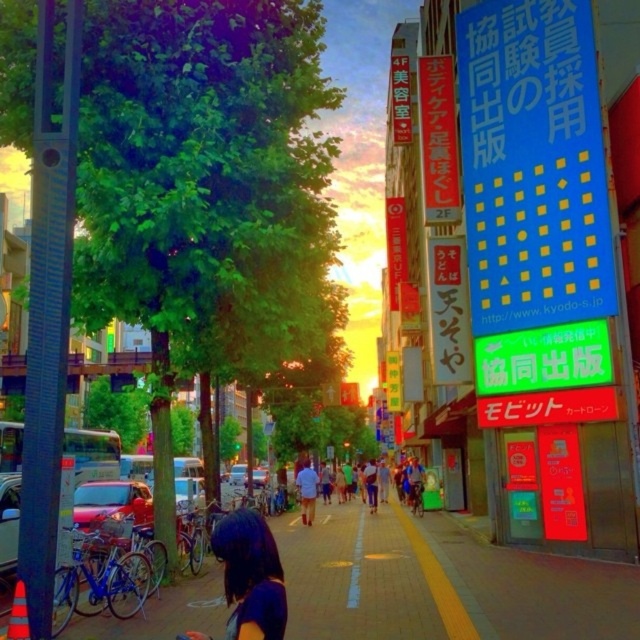
Is point (568, 605) positioned behind point (298, 481)?

No, it is in front of (298, 481).

Between brick pavement at center and light blue shirt at center, which one has more height?

light blue shirt at center

Is point (403, 600) positioned in front of point (310, 493)?

That is True.

At what (x,y) coordinates should I click in order to perform the action: click on brick pavement at center. Please return your answer as a coordinate pair (x, y). Looking at the image, I should click on (442, 582).

How distant is brick pavement at center from denim shorts at center?

brick pavement at center and denim shorts at center are 7.15 meters apart.

Is brick pavement at center closer to the viewer compared to denim shorts at center?

Yes, it is in front of denim shorts at center.

The height and width of the screenshot is (640, 640). Describe the element at coordinates (442, 582) in the screenshot. I see `brick pavement at center` at that location.

Locate an element on the screen. This screenshot has width=640, height=640. brick pavement at center is located at coordinates (442, 582).

Measure the distance between denim shorts at center and light blue shirt at center.

denim shorts at center and light blue shirt at center are 5.13 feet apart from each other.

Between denim shorts at center and light blue shirt at center, which one has more height?

With more height is denim shorts at center.

Who is more distant from viewer, (364, 477) or (308, 476)?

Positioned behind is point (364, 477).

The image size is (640, 640). In order to click on denim shorts at center in this screenshot , I will do `click(310, 488)`.